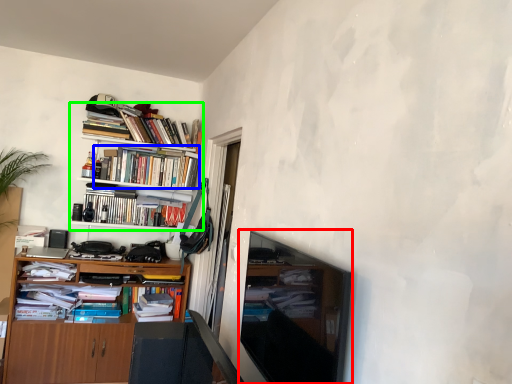
Question: Which is nearer to the television (highlighted by a red box)? book (highlighted by a blue box) or bookcase (highlighted by a green box).

Choices:
 (A) book
 (B) bookcase

Answer: (B)